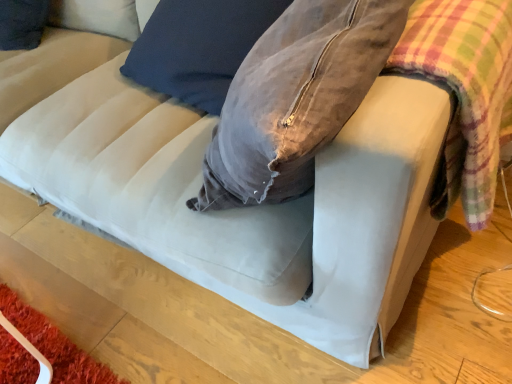
The height and width of the screenshot is (384, 512). What do you see at coordinates (464, 93) in the screenshot?
I see `plaid fabric at right` at bounding box center [464, 93].

You are a GUI agent. You are given a task and a screenshot of the screen. Output one action in this format:
    pyautogui.click(x=<x>, y=<y>)
    Task: Click on the plaid fabric at right
    The width and height of the screenshot is (512, 384).
    Given the screenshot: What is the action you would take?
    pyautogui.click(x=464, y=93)

I want to click on velvet gray bean bag chair at center, so click(x=295, y=98).

This screenshot has width=512, height=384. What do you see at coordinates (295, 98) in the screenshot? I see `velvet gray bean bag chair at center` at bounding box center [295, 98].

At what (x,y) coordinates should I click in order to perform the action: click on plaid fabric at right. Please return your answer as a coordinate pair (x, y). The height and width of the screenshot is (384, 512). Looking at the image, I should click on (464, 93).

In the image, is velvet gray bean bag chair at center on the left side or the right side of plaid fabric at right?

In the image, velvet gray bean bag chair at center appears on the left side of plaid fabric at right.

Is the depth of velvet gray bean bag chair at center less than that of plaid fabric at right?

No.

Is point (223, 145) closer to viewer compared to point (425, 32)?

No, it is not.

From the image's perspective, between velvet gray bean bag chair at center and plaid fabric at right, which one is located above?

velvet gray bean bag chair at center appears higher in the image.

From a real-world perspective, which object stands above the other?

In real-world perspective, plaid fabric at right is above.

Consider the image. Considering the sizes of objects velvet gray bean bag chair at center and plaid fabric at right in the image provided, who is wider, velvet gray bean bag chair at center or plaid fabric at right?

With larger width is velvet gray bean bag chair at center.

Considering the relative sizes of velvet gray bean bag chair at center and plaid fabric at right in the image provided, is velvet gray bean bag chair at center taller than plaid fabric at right?

Yes, velvet gray bean bag chair at center is taller than plaid fabric at right.

Is velvet gray bean bag chair at center bigger than plaid fabric at right?

Correct, velvet gray bean bag chair at center is larger in size than plaid fabric at right.

Is plaid fabric at right surrounded by velvet gray bean bag chair at center?

No, plaid fabric at right is not inside velvet gray bean bag chair at center.

Is velvet gray bean bag chair at center positioned far away from plaid fabric at right?

Actually, velvet gray bean bag chair at center and plaid fabric at right are a little close together.

Is velvet gray bean bag chair at center aimed at plaid fabric at right?

No, velvet gray bean bag chair at center is not facing towards plaid fabric at right.

How far apart are velvet gray bean bag chair at center and plaid fabric at right?

velvet gray bean bag chair at center and plaid fabric at right are 18.75 centimeters apart.

Where is `bean bag chair located on the left of plaid fabric at right`? The width and height of the screenshot is (512, 384). bean bag chair located on the left of plaid fabric at right is located at coordinates (295, 98).

Considering the positions of objects plaid fabric at right and velvet gray bean bag chair at center in the image provided, who is more to the left, plaid fabric at right or velvet gray bean bag chair at center?

Positioned to the left is velvet gray bean bag chair at center.

Considering the relative positions of plaid fabric at right and velvet gray bean bag chair at center in the image provided, is plaid fabric at right in front of velvet gray bean bag chair at center?

Yes, it is.

Is point (423, 60) closer or farther from the camera than point (241, 83)?

Point (423, 60) appears to be closer to the viewer than point (241, 83).

From the image's perspective, is plaid fabric at right on top of velvet gray bean bag chair at center?

No, from the image's perspective, plaid fabric at right is not above velvet gray bean bag chair at center.

From a real-world perspective, is plaid fabric at right positioned above or below velvet gray bean bag chair at center?

In terms of real-world spatial position, plaid fabric at right is above velvet gray bean bag chair at center.

Which object is thinner, plaid fabric at right or velvet gray bean bag chair at center?

Thinner between the two is plaid fabric at right.

Between plaid fabric at right and velvet gray bean bag chair at center, which one has less height?

plaid fabric at right is shorter.

Consider the image. Can you confirm if plaid fabric at right is smaller than velvet gray bean bag chair at center?

Indeed, plaid fabric at right has a smaller size compared to velvet gray bean bag chair at center.

Is plaid fabric at right situated inside velvet gray bean bag chair at center or outside?

plaid fabric at right is outside velvet gray bean bag chair at center.

Are plaid fabric at right and velvet gray bean bag chair at center beside each other?

plaid fabric at right and velvet gray bean bag chair at center are clearly separated.

Is plaid fabric at right oriented towards velvet gray bean bag chair at center?

No, plaid fabric at right does not turn towards velvet gray bean bag chair at center.

How many degrees apart are the facing directions of plaid fabric at right and velvet gray bean bag chair at center?

plaid fabric at right and velvet gray bean bag chair at center are facing 97.8 degrees away from each other.

Measure the distance from plaid fabric at right to velvet gray bean bag chair at center.

The distance of plaid fabric at right from velvet gray bean bag chair at center is 7.38 inches.

This screenshot has height=384, width=512. Identify the location of plaid on the right of the velvet gray bean bag chair at center. (464, 93).

At what (x,y) coordinates should I click in order to perform the action: click on bean bag chair located on the left of plaid fabric at right. Please return your answer as a coordinate pair (x, y). This screenshot has width=512, height=384. Looking at the image, I should click on (295, 98).

At what (x,y) coordinates should I click in order to perform the action: click on bean bag chair below the plaid fabric at right (from a real-world perspective). Please return your answer as a coordinate pair (x, y). Looking at the image, I should click on (295, 98).